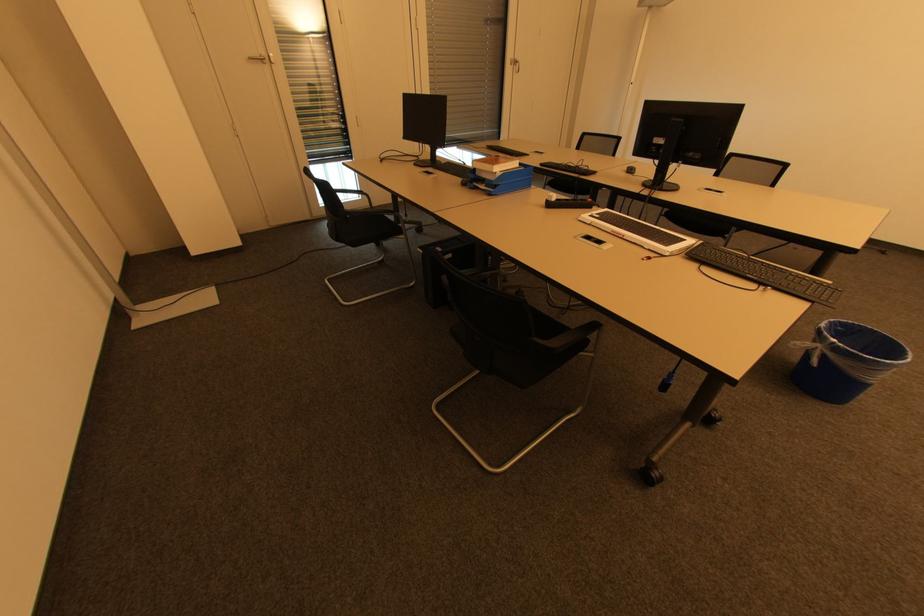
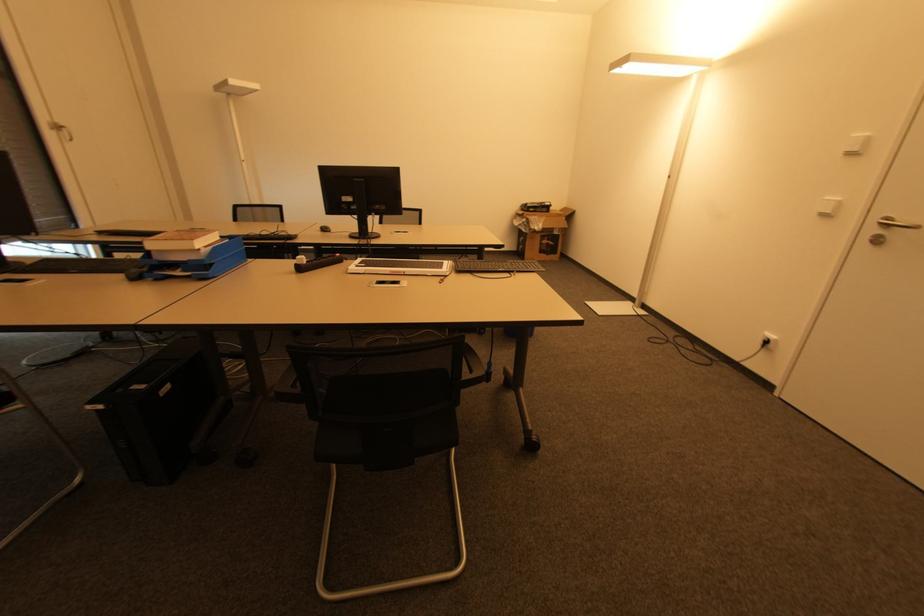
Locate, in the second image, the point that corresponds to pixel 484 187 in the first image.

(178, 274)